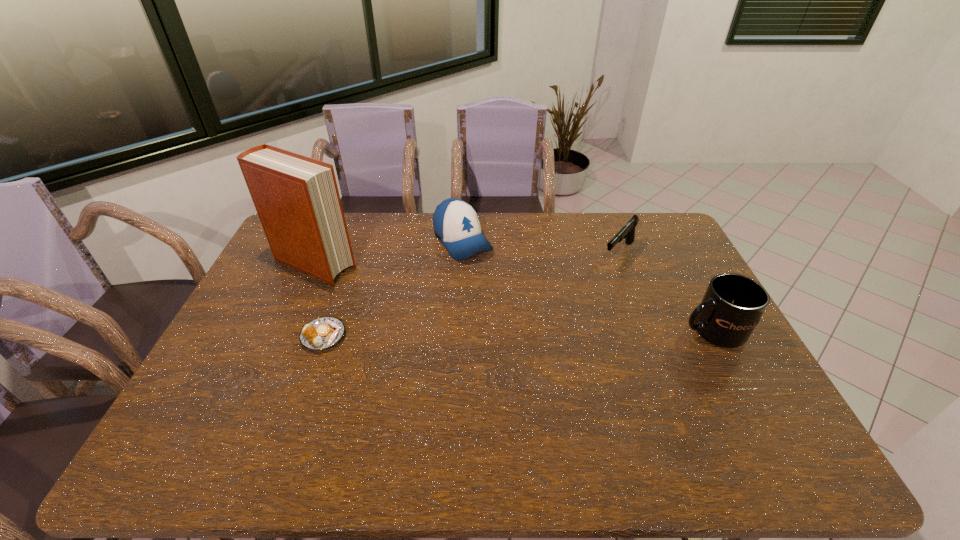
The image size is (960, 540). I want to click on vacant space that is in between the shortest object and the mug, so click(x=517, y=334).

The image size is (960, 540). I want to click on vacant space that's between the pastry and the tallest object, so click(x=320, y=300).

Where is `unoccupied position between the mug and the second shortest object`? unoccupied position between the mug and the second shortest object is located at coordinates (665, 293).

Where is `vacant area that lies between the rightmost object and the tallest object`? Image resolution: width=960 pixels, height=540 pixels. vacant area that lies between the rightmost object and the tallest object is located at coordinates (514, 298).

Find the location of a particular element. free spot between the third object from right to left and the second object from right to left is located at coordinates (540, 247).

Image resolution: width=960 pixels, height=540 pixels. Identify the location of vacant space in between the mug and the baseball cap. (587, 286).

Identify the location of blank region between the hardback book and the mug. This screenshot has height=540, width=960. (514, 298).

I want to click on free space between the hardback book and the rightmost object, so click(x=514, y=298).

What are the coordinates of `free spot between the shortest object and the tallest object` in the screenshot? It's located at (320, 300).

Identify the location of free space between the shortest object and the hardback book. The image size is (960, 540). (320, 300).